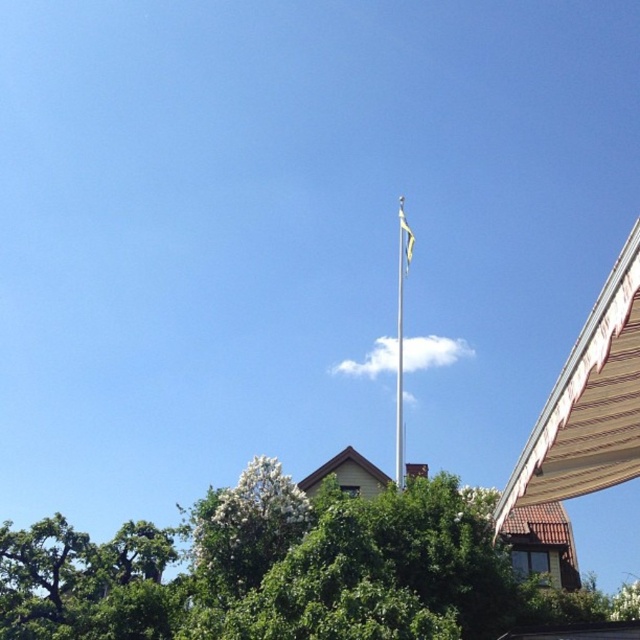
Question: In this image, where is green leafy tree at center located relative to yellow fabric flagpole at center?

Choices:
 (A) left
 (B) right

Answer: (A)

Question: Does silver metallic flag pole at upper center appear over yellow fabric flagpole at center?

Choices:
 (A) yes
 (B) no

Answer: (B)

Question: Which of the following is the farthest from the observer?

Choices:
 (A) green leafy tree at center
 (B) yellow fabric flagpole at center
 (C) yellow fabric flag at upper center

Answer: (C)

Question: Which of the following is the farthest from the observer?

Choices:
 (A) (410, 248)
 (B) (397, 412)
 (C) (403, 227)

Answer: (B)

Question: Is yellow fabric flagpole at center thinner than yellow fabric flag at upper center?

Choices:
 (A) yes
 (B) no

Answer: (B)

Question: Which point appears farthest from the camera in this image?

Choices:
 (A) (408, 237)
 (B) (340, 544)

Answer: (A)